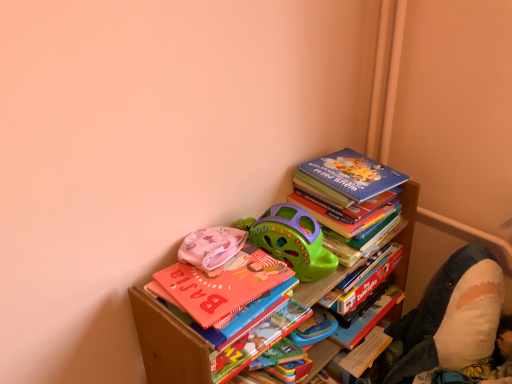
Question: Choose the correct answer: Is multicolored paper at center, acting as the second paperback book starting from the top, inside soft plush shark at right, the 1th toy viewed from the right, or outside it?

Choices:
 (A) inside
 (B) outside

Answer: (B)

Question: Is multicolored paper at center, acting as the second paperback book starting from the top, taller or shorter than soft plush shark at right, the 1th toy viewed from the right?

Choices:
 (A) short
 (B) tall

Answer: (A)

Question: Which object is positioned closest to the soft plush shark at right, the 1th toy viewed from the right?

Choices:
 (A) multicolored paper at center, marked as the 2th paperback book in a right-to-left arrangement
 (B) wooden bookcase at upper right
 (C) blue matte book at upper right
 (D) hardcover book at upper right, arranged as the first paperback book when viewed from the right
 (E) pink fabric at upper left, which ranks as the 1th toy in left-to-right order

Answer: (D)

Question: Which object is positioned closest to the pink fabric at upper left, which ranks as the 1th toy in left-to-right order?

Choices:
 (A) hardcover book at upper right, the 2th paperback book from the left
 (B) green plastic toy car at upper center, positioned as the 2th toy in left-to-right order
 (C) blue matte book at upper right
 (D) soft plush shark at right, the 1th toy viewed from the right
 (E) wooden bookcase at upper right

Answer: (B)